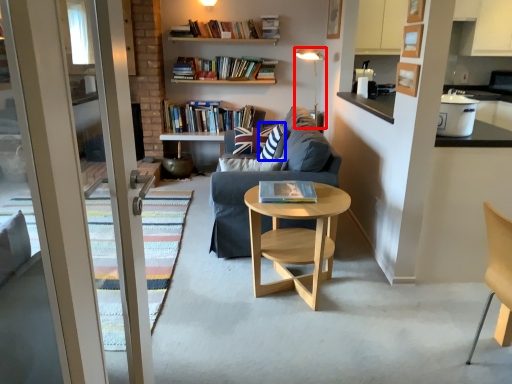
Question: Which object appears farthest to the camera in this image, light fixture (highlighted by a red box) or pillow (highlighted by a blue box)?

Choices:
 (A) light fixture
 (B) pillow

Answer: (A)